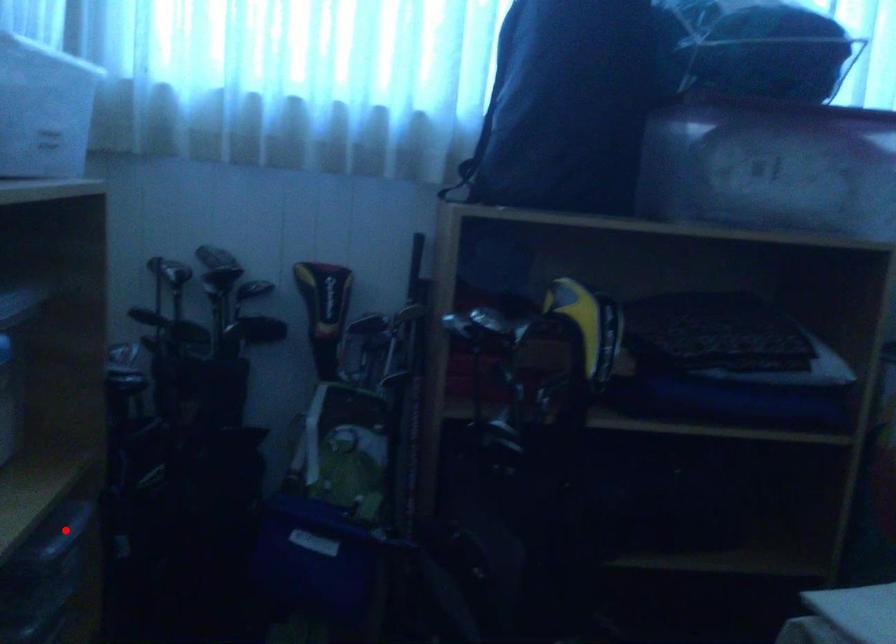
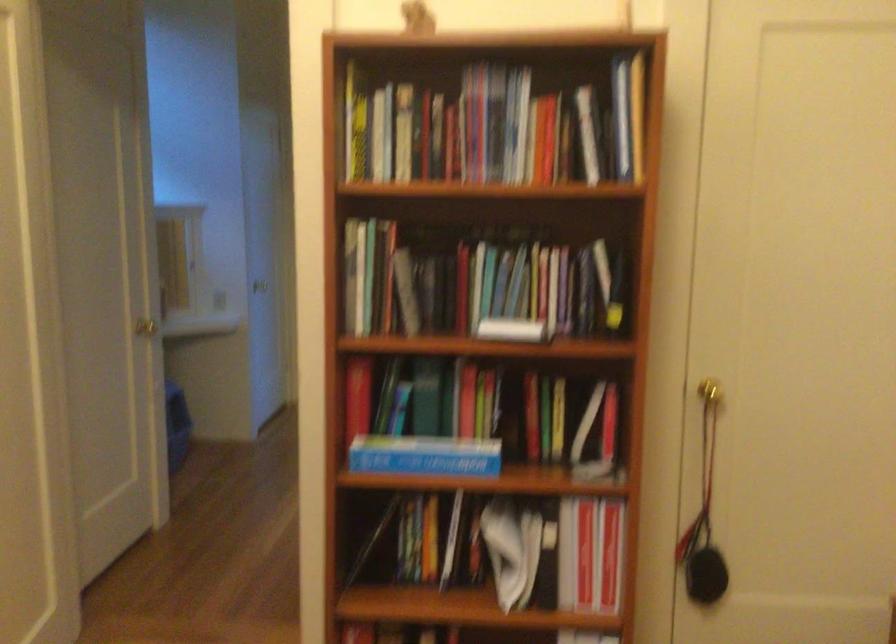
Question: I am providing you with two images of the same scene from different viewpoints. A red point is marked on the first image. Is the red point's position out of view in image 2?

Choices:
 (A) Yes
 (B) No

Answer: (A)